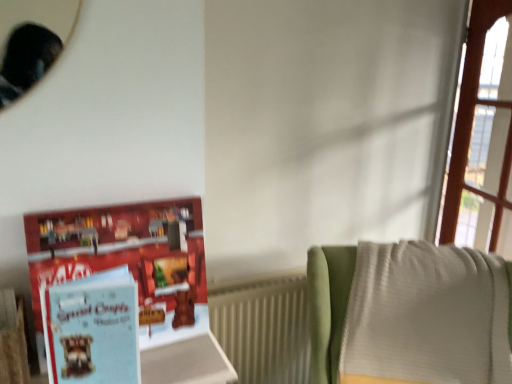
Image resolution: width=512 pixels, height=384 pixels. Describe the element at coordinates (264, 328) in the screenshot. I see `white ribbed radiator at lower right` at that location.

Image resolution: width=512 pixels, height=384 pixels. What do you see at coordinates (328, 306) in the screenshot?
I see `white textured blanket at right` at bounding box center [328, 306].

What are the coordinates of `white textured blanket at right` in the screenshot? It's located at (328, 306).

Where is `white ribbed radiator at lower right`? The height and width of the screenshot is (384, 512). white ribbed radiator at lower right is located at coordinates (264, 328).

What's the angular difference between light blue paper book at left and white ribbed radiator at lower right's facing directions?

They differ by 1.5 degrees in their facing directions.

Does light blue paper book at left touch white ribbed radiator at lower right?

There is a gap between light blue paper book at left and white ribbed radiator at lower right.

From the image's perspective, is light blue paper book at left positioned above or below white ribbed radiator at lower right?

Clearly, from the image's perspective, light blue paper book at left is above white ribbed radiator at lower right.

Is light blue paper book at left surrounding white ribbed radiator at lower right?

No, white ribbed radiator at lower right is not inside light blue paper book at left.

Does light blue paper at left turn towards white ribbed radiator at lower right?

No, light blue paper at left is not turned towards white ribbed radiator at lower right.

At what (x,y) coordinates should I click in order to perform the action: click on paperback book above the white ribbed radiator at lower right (from a real-world perspective). Please return your answer as a coordinate pair (x, y). Looking at the image, I should click on (92, 329).

Considering the relative sizes of light blue paper at left and white ribbed radiator at lower right in the image provided, is light blue paper at left shorter than white ribbed radiator at lower right?

Correct, light blue paper at left is not as tall as white ribbed radiator at lower right.

Would you say light blue paper at left is to the left or to the right of white ribbed radiator at lower right in the picture?

light blue paper at left is positioned on white ribbed radiator at lower right's left side.

Does point (509, 283) appear closer or farther from the camera than point (266, 330)?

Point (509, 283) is closer to the camera than point (266, 330).

Is white textured blanket at right positioned with its back to white ribbed radiator at lower right?

No, white ribbed radiator at lower right is not at the back of white textured blanket at right.

Considering the relative sizes of white textured blanket at right and white ribbed radiator at lower right in the image provided, is white textured blanket at right bigger than white ribbed radiator at lower right?

Correct, white textured blanket at right is larger in size than white ribbed radiator at lower right.

From a real-world perspective, who is located lower, white textured blanket at right or white ribbed radiator at lower right?

white ribbed radiator at lower right is physically lower.

Who is more distant, light blue paper at left or white textured blanket at right?

white textured blanket at right is behind.

Can you confirm if light blue paper at left is thinner than white textured blanket at right?

Indeed, light blue paper at left has a lesser width compared to white textured blanket at right.

Considering the points (132, 354) and (315, 247), which point is behind, point (132, 354) or point (315, 247)?

The point (315, 247) is farther.

From a real-world perspective, is white ribbed radiator at lower right under white textured blanket at right?

Indeed, from a real-world perspective, white ribbed radiator at lower right is positioned beneath white textured blanket at right.

From the image's perspective, which is below, white ribbed radiator at lower right or white textured blanket at right?

white ribbed radiator at lower right is shown below in the image.

Is the depth of white ribbed radiator at lower right greater than that of white textured blanket at right?

Yes.

Considering the sizes of objects white ribbed radiator at lower right and white textured blanket at right in the image provided, who is shorter, white ribbed radiator at lower right or white textured blanket at right?

Standing shorter between the two is white textured blanket at right.

Does point (113, 335) lie in front of point (149, 338)?

That is True.

In terms of width, does light blue paper at left look wider or thinner when compared to light blue paper book at left?

Clearly, light blue paper at left has more width compared to light blue paper book at left.

Is the surface of light blue paper at left in direct contact with light blue paper book at left?

No, light blue paper at left is not touching light blue paper book at left.

From the image's perspective, is light blue paper at left beneath light blue paper book at left?

Yes, from the image's perspective, light blue paper at left is below light blue paper book at left.

Is white textured blanket at right wider than light blue paper at left?

Correct, the width of white textured blanket at right exceeds that of light blue paper at left.

Is white textured blanket at right inside the boundaries of light blue paper at left, or outside?

white textured blanket at right exists outside the volume of light blue paper at left.

Is white textured blanket at right not near light blue paper at left?

No.

Between white textured blanket at right and light blue paper at left, which one has smaller size?

light blue paper at left.

This screenshot has height=384, width=512. What are the coordinates of `radiator on the right of light blue paper book at left` in the screenshot? It's located at (264, 328).

Locate an element on the screen. This screenshot has height=384, width=512. radiator located below the light blue paper at left (from the image's perspective) is located at coordinates (264, 328).

Estimate the real-world distances between objects in this image. Which object is closer to light blue paper book at left, light blue paper at left or white ribbed radiator at lower right?

light blue paper at left lies closer to light blue paper book at left than the other object.

Estimate the real-world distances between objects in this image. Which object is closer to light blue paper book at left, white ribbed radiator at lower right or light blue paper at left?

The object closer to light blue paper book at left is light blue paper at left.

Estimate the real-world distances between objects in this image. Which object is closer to white textured blanket at right, light blue paper at left or white ribbed radiator at lower right?

Based on the image, white ribbed radiator at lower right appears to be nearer to white textured blanket at right.

When comparing their distances from light blue paper book at left, does white textured blanket at right or light blue paper at left seem further?

white textured blanket at right lies further to light blue paper book at left than the other object.

Considering their positions, is white ribbed radiator at lower right positioned closer to light blue paper book at left than white textured blanket at right?

white textured blanket at right lies closer to light blue paper book at left than the other object.

Considering their positions, is light blue paper at left positioned further to white ribbed radiator at lower right than white textured blanket at right?

Among the two, light blue paper at left is located further to white ribbed radiator at lower right.

Which object lies nearer to the anchor point white textured blanket at right, light blue paper at left or light blue paper book at left?

light blue paper book at left lies closer to white textured blanket at right than the other object.

Estimate the real-world distances between objects in this image. Which object is further from light blue paper at left, white ribbed radiator at lower right or white textured blanket at right?

Among the two, white ribbed radiator at lower right is located further to light blue paper at left.

The width and height of the screenshot is (512, 384). Find the location of `book between light blue paper at left and white ribbed radiator at lower right along the z-axis`. book between light blue paper at left and white ribbed radiator at lower right along the z-axis is located at coordinates (129, 259).

Locate an element on the screen. book located between light blue paper at left and white textured blanket at right in the left-right direction is located at coordinates (129, 259).

I want to click on radiator situated between light blue paper book at left and white textured blanket at right from left to right, so click(x=264, y=328).

This screenshot has height=384, width=512. Identify the location of radiator located between light blue paper at left and white textured blanket at right in the left-right direction. (264, 328).